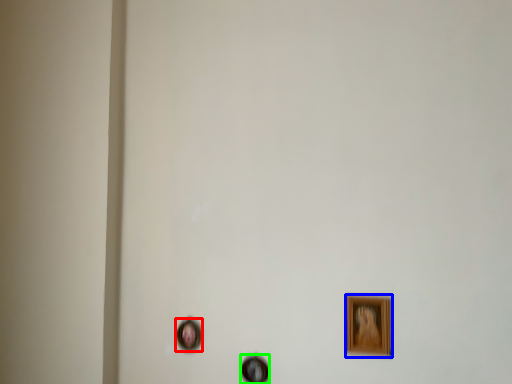
Question: Estimate the real-world distances between objects in this image. Which object is closer to picture frame (highlighted by a red box), picture frame (highlighted by a blue box) or picture frame (highlighted by a green box)?

Choices:
 (A) picture frame
 (B) picture frame

Answer: (B)